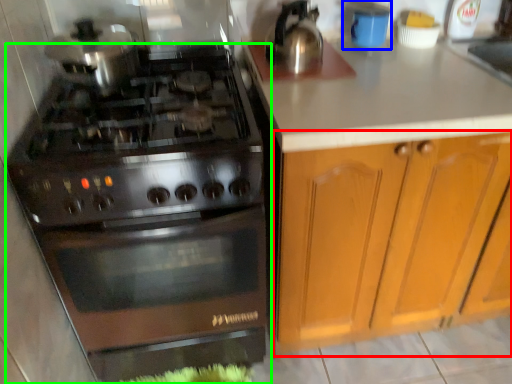
Question: Based on their relative distances, which object is farther from cabinetry (highlighted by a red box)? Choose from appliance (highlighted by a blue box) and gas stove (highlighted by a green box).

Choices:
 (A) appliance
 (B) gas stove

Answer: (A)